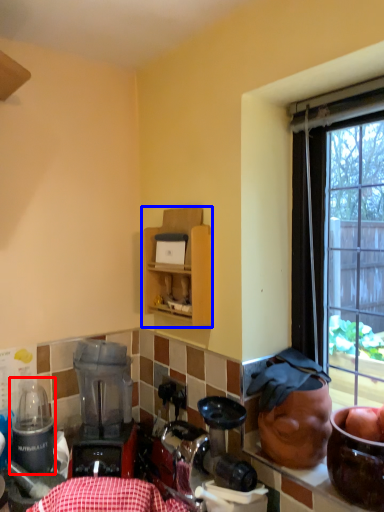
Question: Which of the following is the farthest to the observer, appliance (highlighted by a red box) or cabinetry (highlighted by a blue box)?

Choices:
 (A) appliance
 (B) cabinetry

Answer: (B)